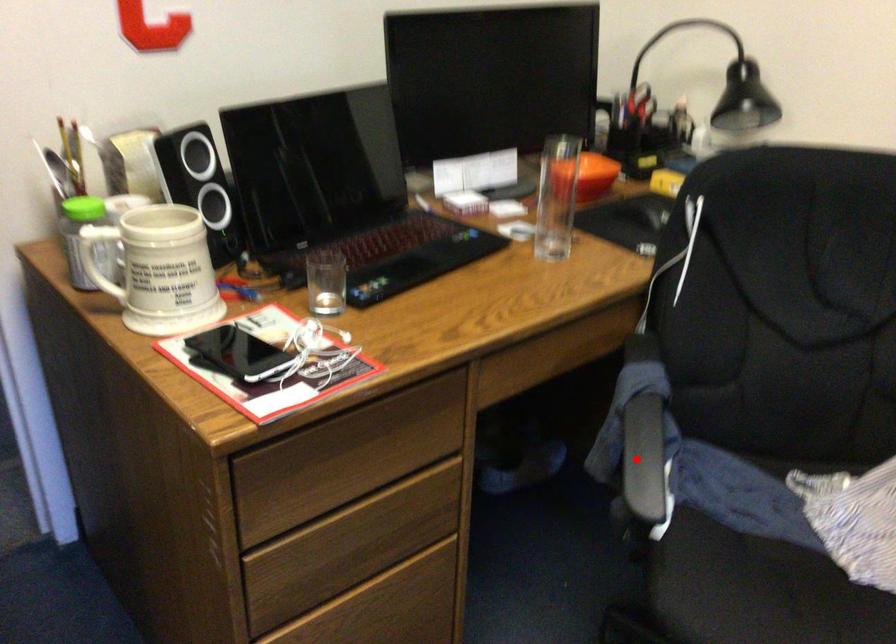
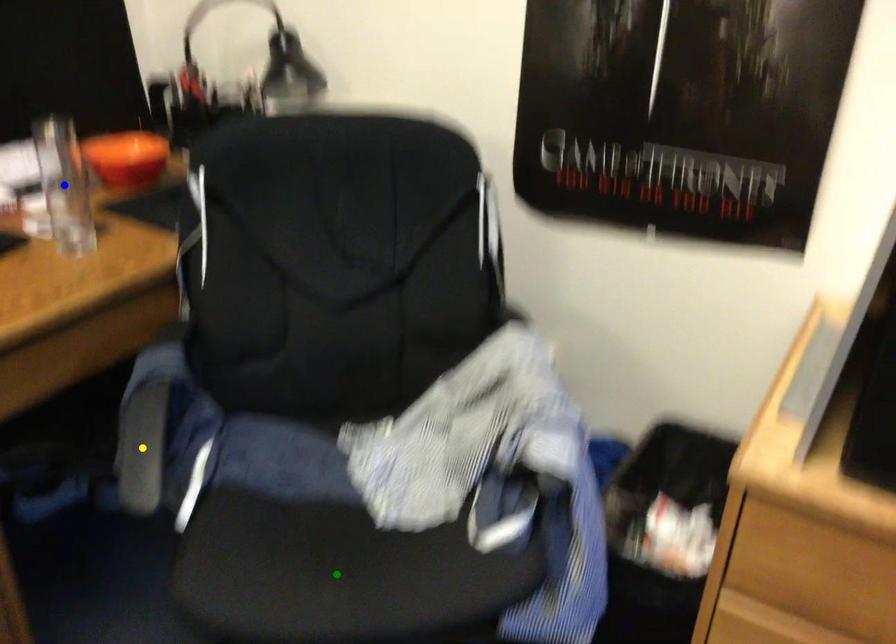
Question: I am providing you with two images of the same scene from different viewpoints. A red point is marked on the first image. You are given multiple points on the second image. Which spot in image 2 lines up with the point in image 1?

Choices:
 (A) green point
 (B) yellow point
 (C) blue point

Answer: (B)